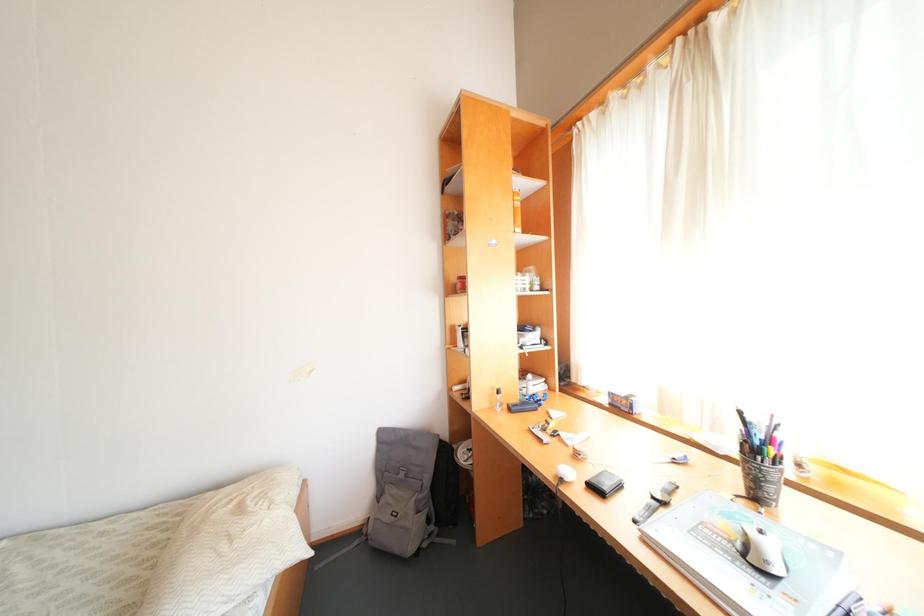
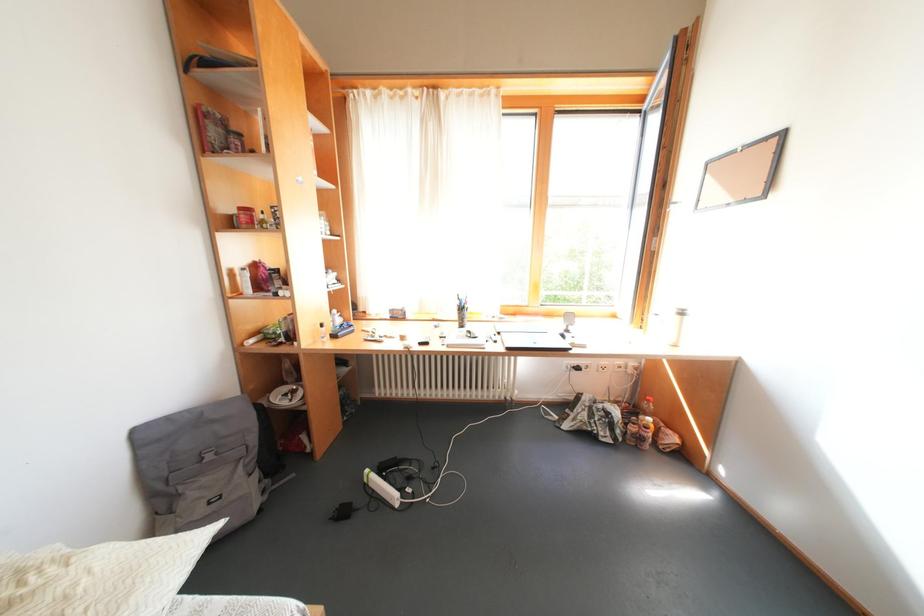
Question: The camera is either moving clockwise (left) or counter-clockwise (right) around the object. The first image is from the beginning of the video and the second image is from the end. Is the camera moving left or right when shooting the video?

Choices:
 (A) Left
 (B) Right

Answer: (A)